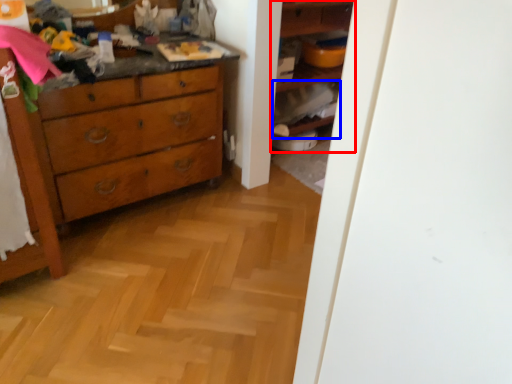
Question: Which of the following is the farthest to the observer, shelf (highlighted by a red box) or cabinet (highlighted by a blue box)?

Choices:
 (A) shelf
 (B) cabinet

Answer: (B)